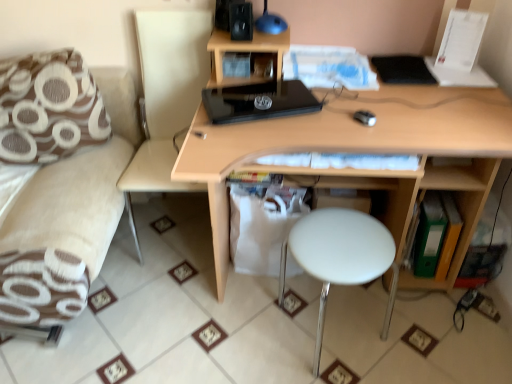
Question: Is black glossy laptop at center wider or thinner than black matte speaker at upper center?

Choices:
 (A) thin
 (B) wide

Answer: (B)

Question: Choose the correct answer: Is black glossy laptop at center inside black matte speaker at upper center or outside it?

Choices:
 (A) outside
 (B) inside

Answer: (A)

Question: Which object is positioned closest to the black glossy laptop at center?

Choices:
 (A) brown fabric couch at left
 (B) brown fabric pillow at left
 (C) light wood desk at center
 (D) beige fabric swivel chair at left
 (E) green plastic folder at lower right

Answer: (C)

Question: Which is farther from the black glossy laptop at center?

Choices:
 (A) green plastic folder at lower right
 (B) black matte speaker at upper center
 (C) brown fabric pillow at left
 (D) light wood desk at center
 (E) beige fabric swivel chair at left

Answer: (A)